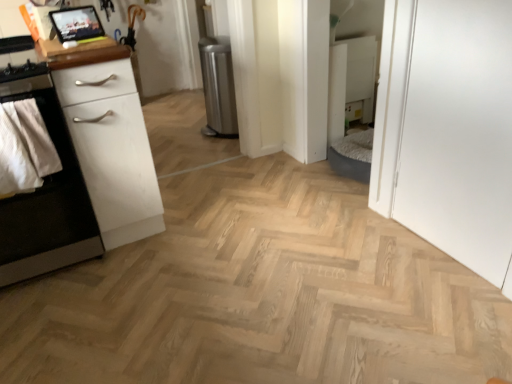
Locate an element on the screen. Image resolution: width=512 pixels, height=384 pixels. free location in front of white matte chest of drawers at left is located at coordinates (122, 280).